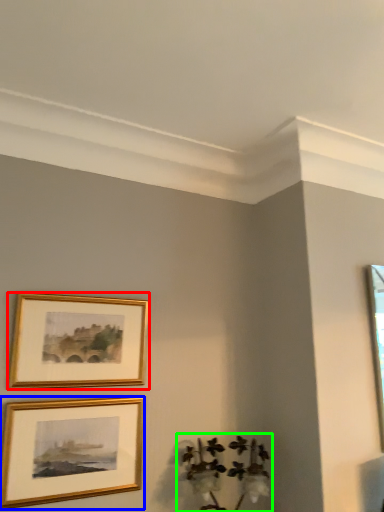
Question: Which object is the farthest from picture frame (highlighted by a red box)? Choose among these: picture frame (highlighted by a blue box) or plant (highlighted by a green box).

Choices:
 (A) picture frame
 (B) plant

Answer: (B)